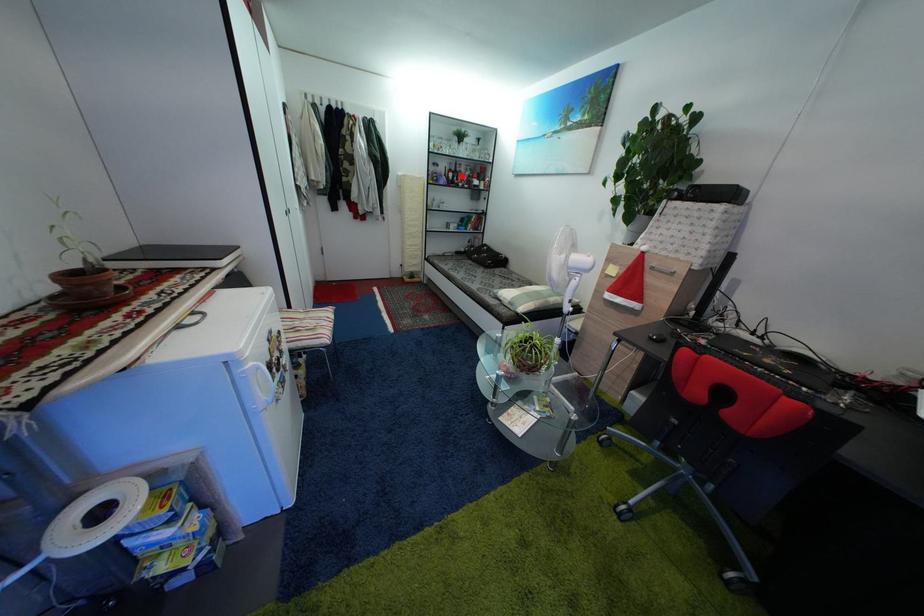
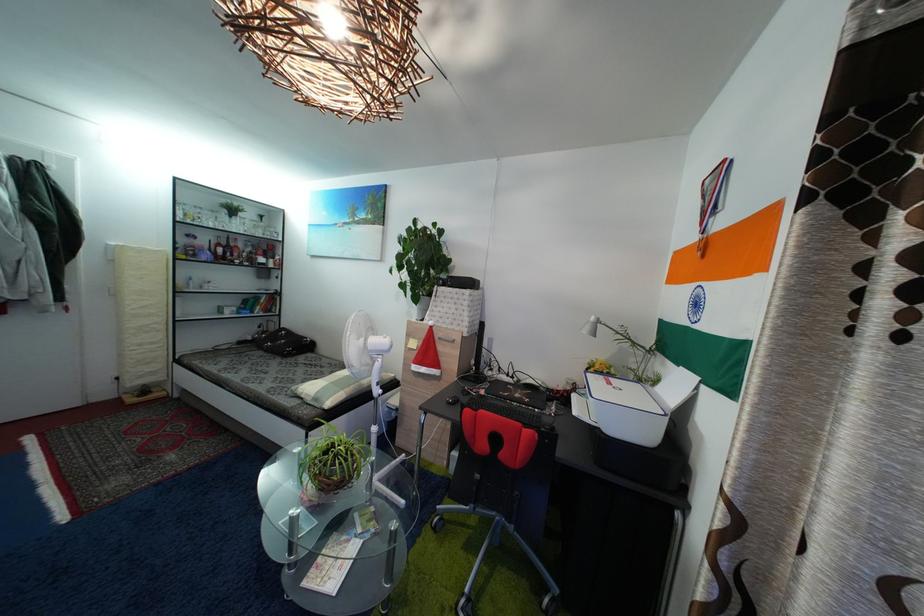
Question: I am providing you with two images of the same scene from different viewpoints. In image1, a red point is highlighted. Considering the same 3D point in image2, which of the following is correct?

Choices:
 (A) It is closer
 (B) It is farther

Answer: (B)